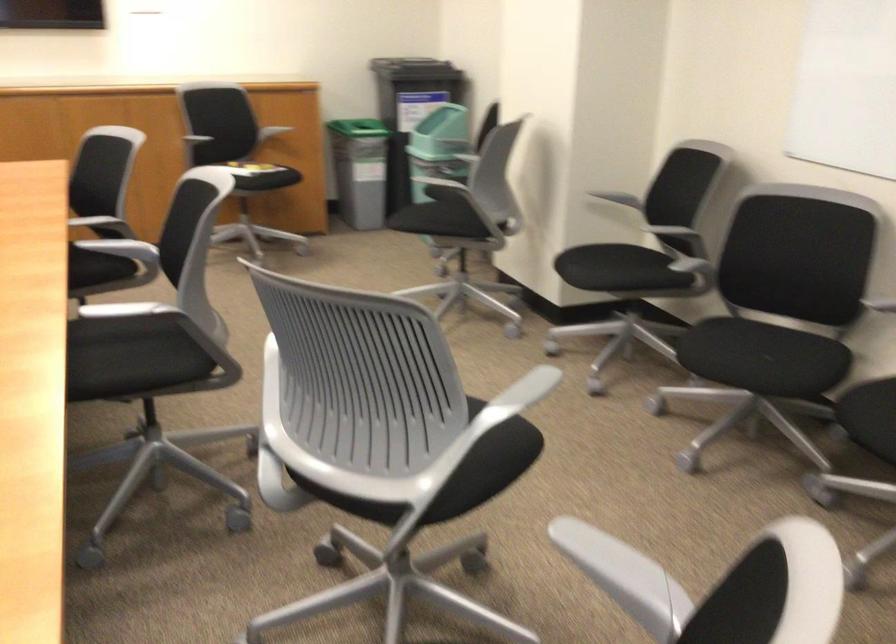
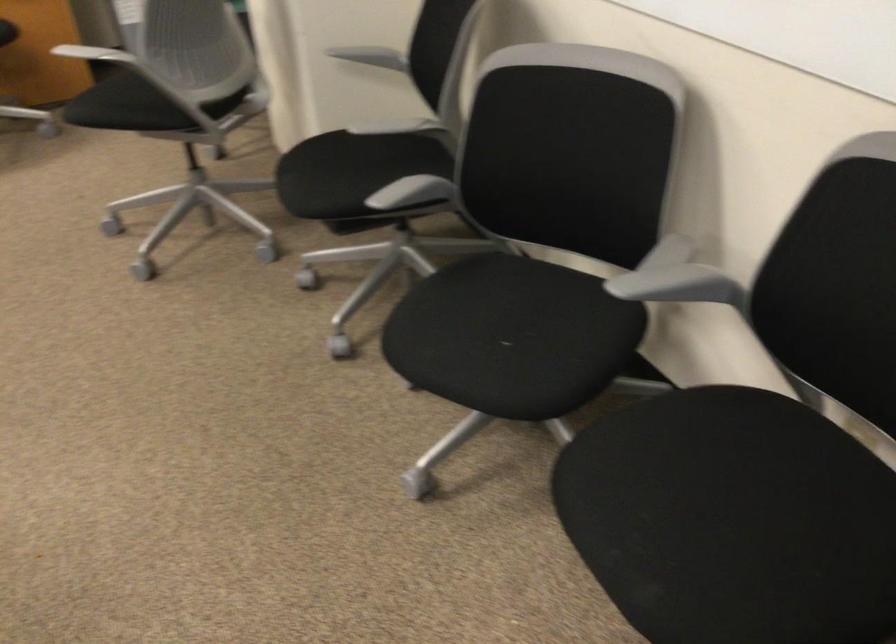
Locate, in the second image, the point that corresponds to pixel 744 351 in the first image.

(494, 337)